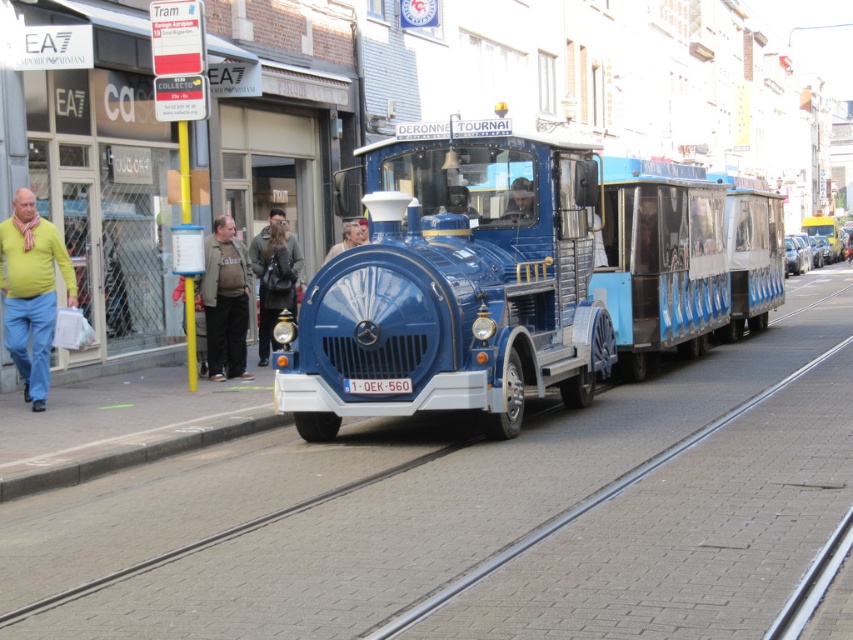
You are a pedestrian standing on the street and see the blue metallic train at center and the dark gray sweater at left. Which object is closer to you?

The blue metallic train at center is closer to you because it is in front of the dark gray sweater at left.

You are a pedestrian standing at the point labeled as point (x=274, y=284). You want to cross the street to reach the blue miniature train labeled DERONNE TOURNAI. Is the dark brown leather jacket at center located between you and the train?

The dark brown leather jacket at center is located at point (x=274, y=284), which is where you are standing. Therefore, the dark brown leather jacket at center is not between you and the train but is at your current position.

You are a street vendor who wants to place a new stand between the dark gray sweater at left and the dark brown leather jacket at center. Since you need to know which one takes up more space, can you tell me which one is larger?

The dark brown leather jacket at center occupies more space than the dark gray sweater at left, so the stand should be placed closer to the smaller object to accommodate both.